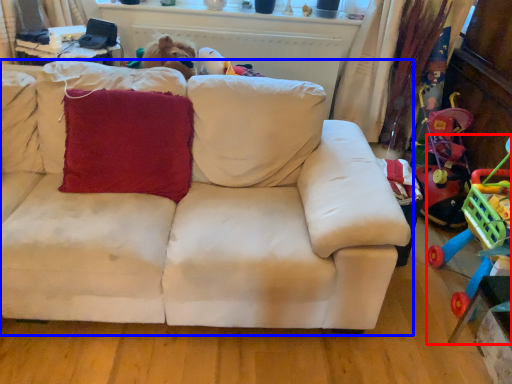
Question: Which object appears farthest to the camera in this image, toy (highlighted by a red box) or studio couch (highlighted by a blue box)?

Choices:
 (A) toy
 (B) studio couch

Answer: (B)